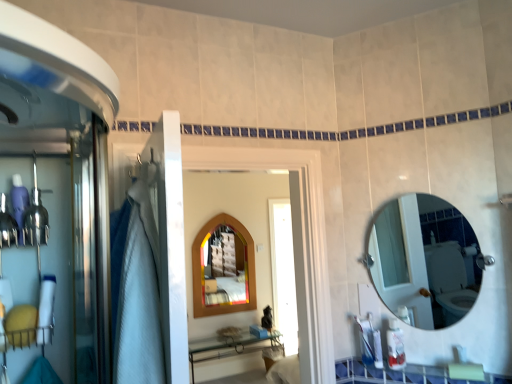
Question: From a real-world perspective, is wooden arched mirror at center positioned above or below clear glass mirror at upper right, which appears as the 1th mirror when viewed from the front?

Choices:
 (A) above
 (B) below

Answer: (B)

Question: Relative to clear glass mirror at upper right, the 2th mirror positioned from the left, is wooden arched mirror at center in front or behind?

Choices:
 (A) front
 (B) behind

Answer: (A)

Question: Which of these objects is positioned closest to the white glossy counter top at lower center?

Choices:
 (A) translucent plastic bottle at lower right
 (B) wooden stained mirror at center, the second mirror from the right
 (C) wooden arched mirror at center
 (D) clear glass mirror at upper right, which ranks as the 2th mirror in back-to-front order

Answer: (A)

Question: Which of these objects is positioned farthest from the white glossy counter top at lower center?

Choices:
 (A) translucent plastic bottle at lower right
 (B) wooden stained mirror at center, which appears as the first mirror when viewed from the left
 (C) clear glass mirror at upper right, which appears as the 1th mirror when viewed from the front
 (D) wooden arched mirror at center

Answer: (B)